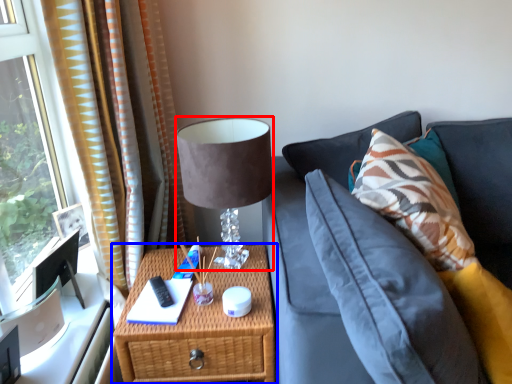
Question: Which object is further to the camera taking this photo, table lamp (highlighted by a red box) or nightstand (highlighted by a blue box)?

Choices:
 (A) table lamp
 (B) nightstand

Answer: (B)